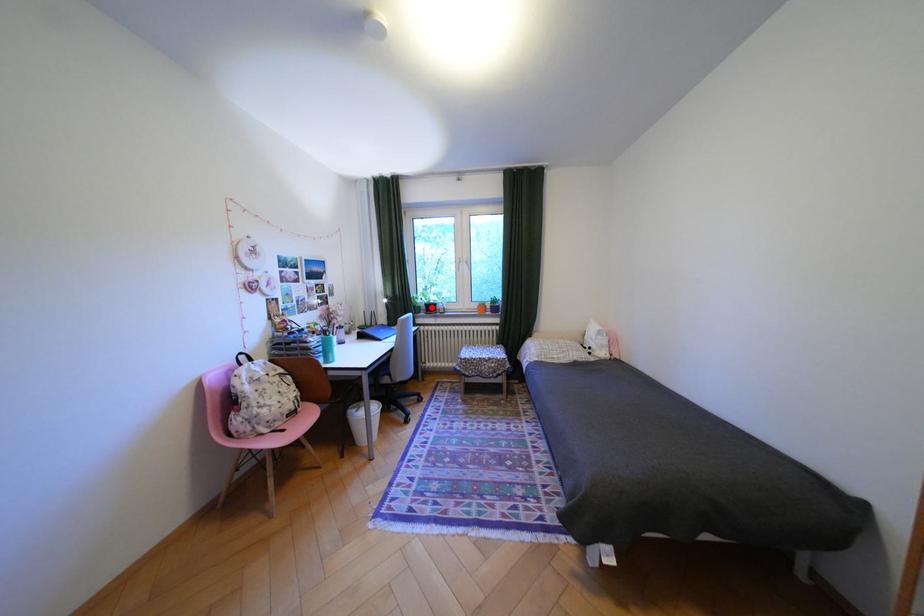
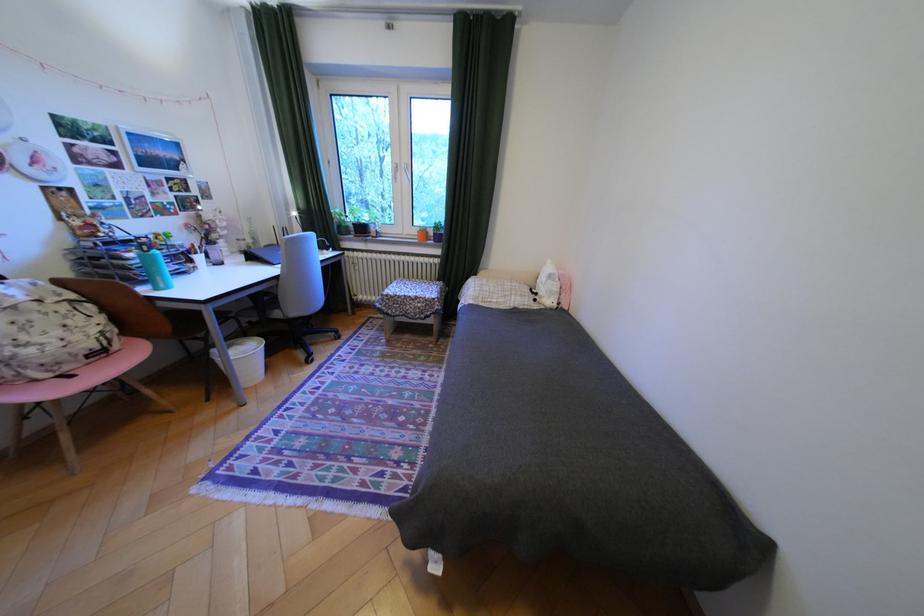
In the second image, find the point that corresponds to the highlighted location in the first image.

(359, 227)